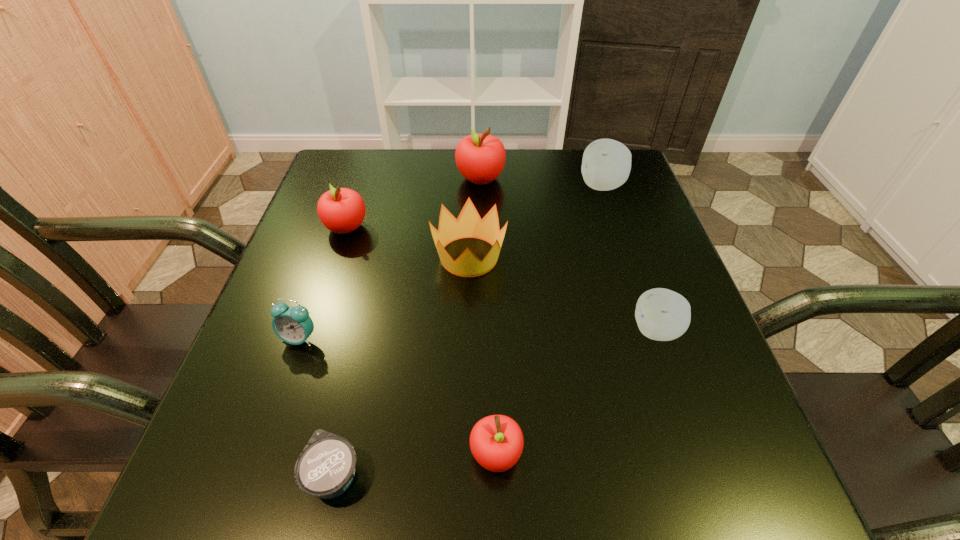
Find the location of `free region located on the back of the yogurt`. free region located on the back of the yogurt is located at coordinates (379, 272).

The width and height of the screenshot is (960, 540). Identify the location of apple located in the near edge section of the desktop. (496, 442).

Where is `yogurt located in the near edge section of the desktop`? This screenshot has width=960, height=540. yogurt located in the near edge section of the desktop is located at coordinates (325, 468).

In order to click on apple present at the left edge in this screenshot , I will do `click(341, 210)`.

I want to click on alarm clock situated at the left edge, so click(293, 325).

Locate an element on the screen. The width and height of the screenshot is (960, 540). yogurt present at the left edge is located at coordinates (325, 468).

I want to click on object that is positioned at the near left corner, so click(x=325, y=468).

At what (x,y) coordinates should I click in order to perform the action: click on object located at the far right corner. Please return your answer as a coordinate pair (x, y). Looking at the image, I should click on (606, 164).

The height and width of the screenshot is (540, 960). In the image, there is a desktop. Identify the location of vacant space at the far edge. (506, 150).

Find the location of a particular element. This screenshot has width=960, height=540. free region at the left edge is located at coordinates (215, 431).